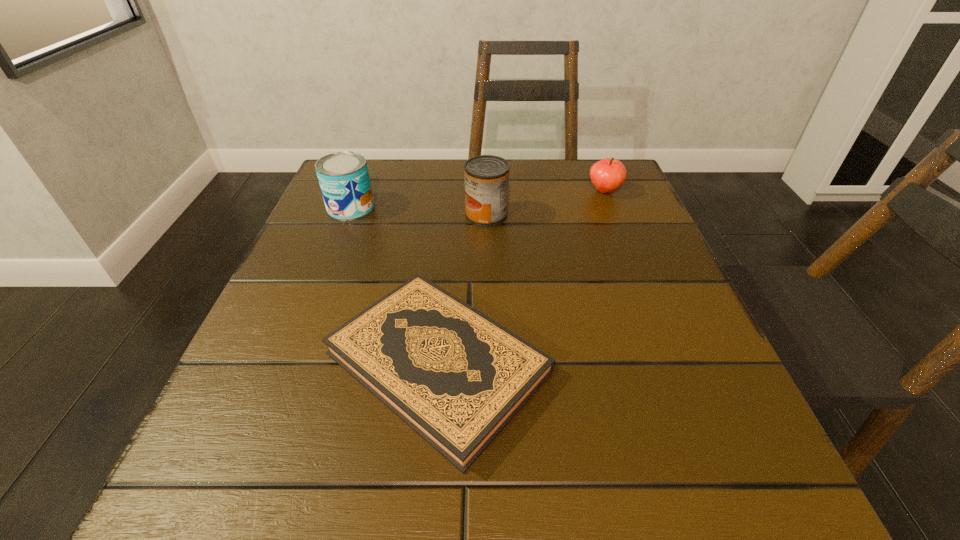
Identify the location of free spot at the far left corner of the desktop. (386, 214).

You are a GUI agent. You are given a task and a screenshot of the screen. Output one action in this format:
    pyautogui.click(x=<x>, y=<y>)
    Task: Click on the vacant space at the near left corner
    
    Given the screenshot: What is the action you would take?
    pyautogui.click(x=262, y=454)

Find the location of a particular element. The image size is (960, 540). vacant point at the far right corner is located at coordinates (629, 179).

Find the location of a particular element. free point at the near right corner is located at coordinates 741,497.

Find the location of `free spot between the right can and the rightmost object`. free spot between the right can and the rightmost object is located at coordinates (545, 203).

Where is `vacant area that lies between the hardback book and the left can`? vacant area that lies between the hardback book and the left can is located at coordinates (395, 285).

This screenshot has height=540, width=960. Find the location of `free space between the leftmost object and the hardback book`. free space between the leftmost object and the hardback book is located at coordinates (395, 285).

The image size is (960, 540). I want to click on free space between the right can and the leftmost object, so click(x=419, y=211).

You are a GUI agent. You are given a task and a screenshot of the screen. Output one action in this format:
    pyautogui.click(x=<x>, y=<y>)
    Task: Click on the vacant space that's between the right can and the apple
    
    Given the screenshot: What is the action you would take?
    pyautogui.click(x=545, y=203)

Locate an element on the screen. free space between the left can and the right can is located at coordinates (419, 211).